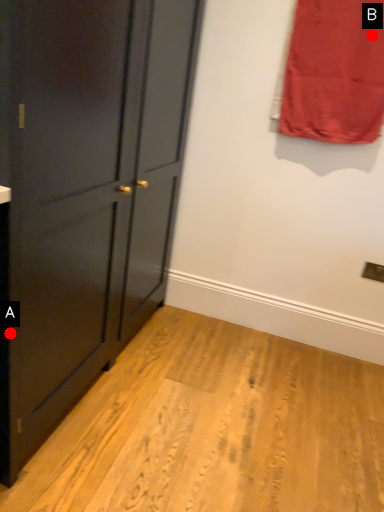
Question: Two points are circled on the image, labeled by A and B beside each circle. Which of the following is the closest to the observer?

Choices:
 (A) A is closer
 (B) B is closer

Answer: (A)